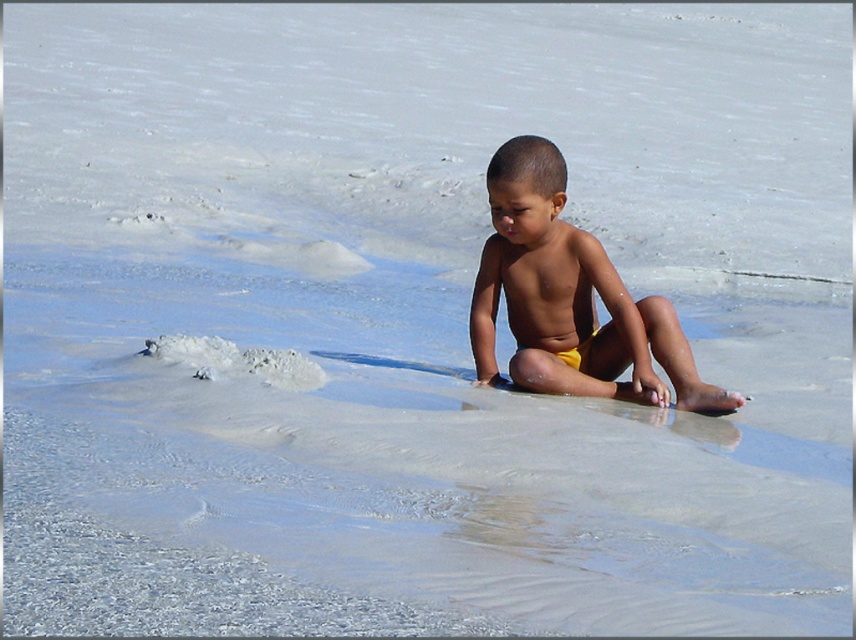
From the picture: You are a photographer trying to capture the child in the scene. You notice two pairs of shorts on the child. Which pair of shorts, the yellow fabric shorts at center or the smooth yellow shorts at center, is closer to the camera?

The yellow fabric shorts at center is in front of smooth yellow shorts at center, so the yellow fabric shorts at center is closer to the camera.

You are standing next to a camera that is pointed at the beach scene. The camera is set to capture a closeup shot of the yellow fabric shorts at center. Given the distance between the camera and the shorts, will the camera be able to focus clearly on the shorts?

The yellow fabric shorts at center and camera are 17.89 feet apart from each other. Since most cameras can focus clearly at distances of 17.89 feet or more, the camera should be able to focus clearly on the shorts.

You are a photographer trying to capture the child in the scene. You notice two pairs of shorts on the child. Which pair is on top, the yellow fabric shorts at center or the smooth yellow shorts at center?

The smooth yellow shorts at center are on top because the yellow fabric shorts at center is positioned under them.